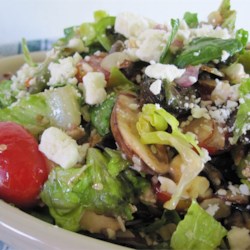
Locate an element on the screen. This screenshot has width=250, height=250. bowl is located at coordinates (32, 234).